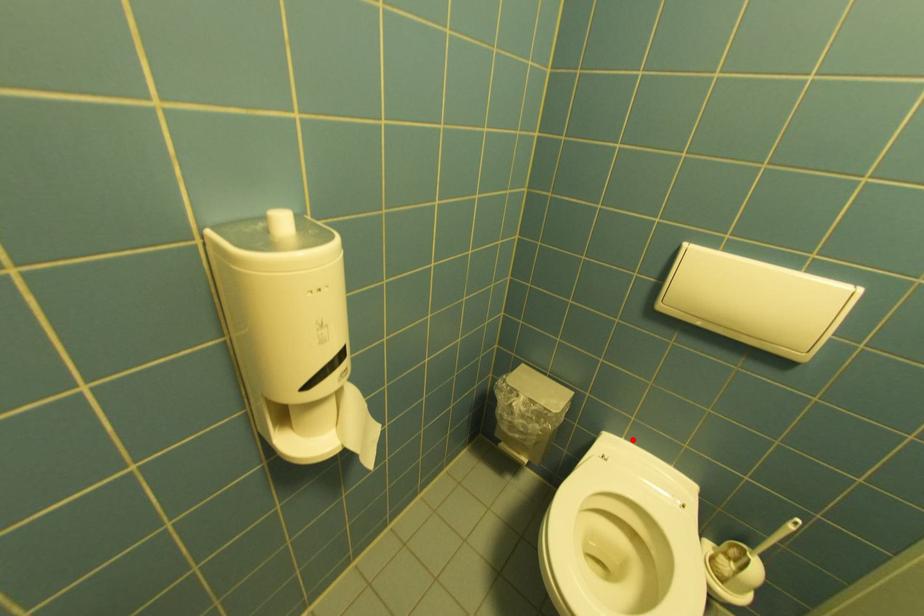
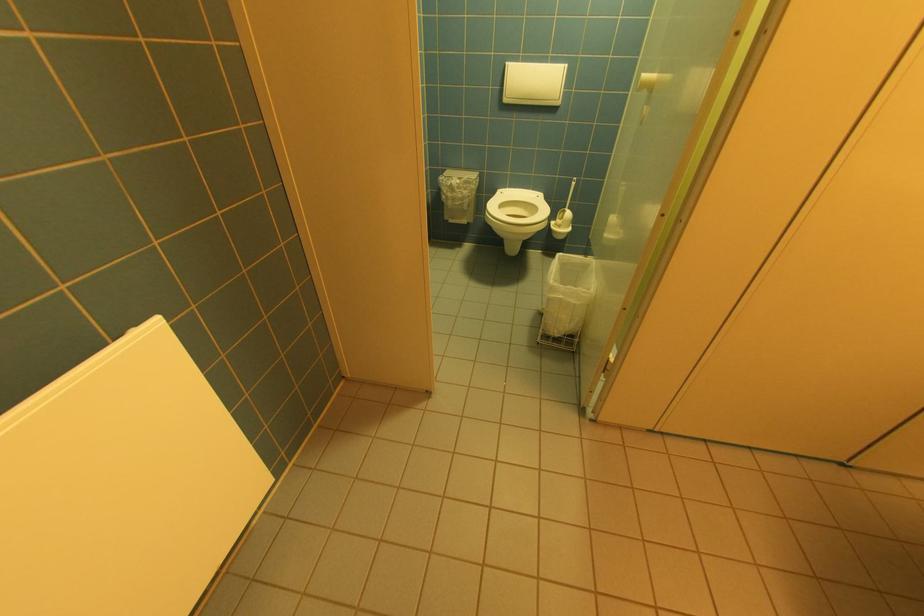
Where in the second image is the point corresponding to the highlighted location from the first image?

(515, 188)